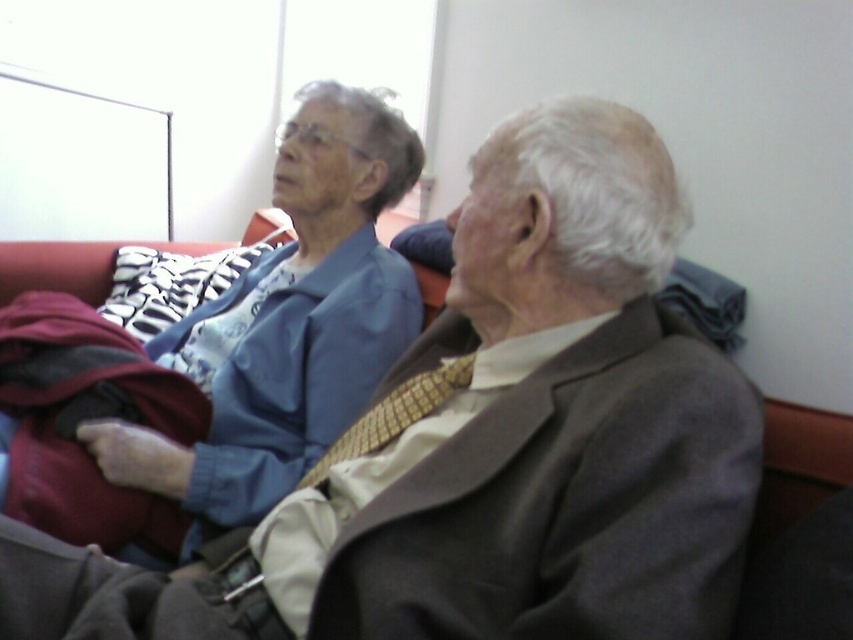
Question: Does blue fabric at left have a greater width compared to yellow textured tie at center?

Choices:
 (A) no
 (B) yes

Answer: (B)

Question: Which of the following is the farthest from the observer?

Choices:
 (A) blue fabric at left
 (B) yellow textured tie at center

Answer: (A)

Question: Which object appears closest to the camera in this image?

Choices:
 (A) blue fabric at left
 (B) yellow textured tie at center

Answer: (B)

Question: Can you confirm if blue fabric at left is positioned to the right of yellow textured tie at center?

Choices:
 (A) yes
 (B) no

Answer: (B)

Question: Does blue fabric at left have a smaller size compared to yellow textured tie at center?

Choices:
 (A) no
 (B) yes

Answer: (A)